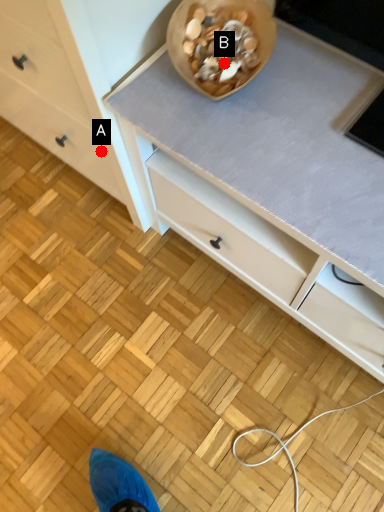
Question: Two points are circled on the image, labeled by A and B beside each circle. Which of the following is the closest to the observer?

Choices:
 (A) A is closer
 (B) B is closer

Answer: (B)